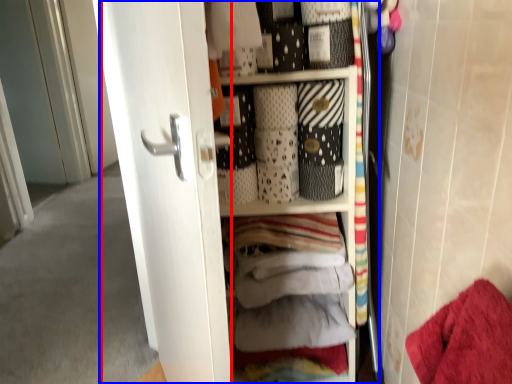
Question: Which object appears farthest to the camera in this image, screen door (highlighted by a red box) or dresser (highlighted by a blue box)?

Choices:
 (A) screen door
 (B) dresser

Answer: (B)